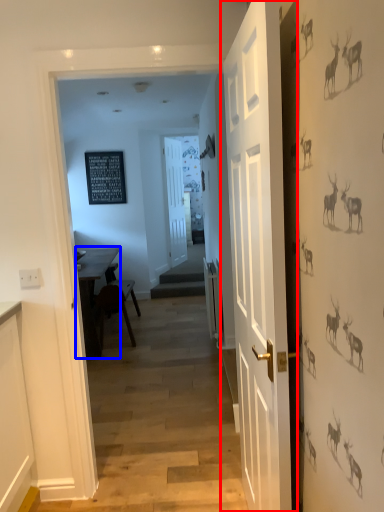
Question: Among these objects, which one is nearest to the camera, door (highlighted by a red box) or table (highlighted by a blue box)?

Choices:
 (A) door
 (B) table

Answer: (A)